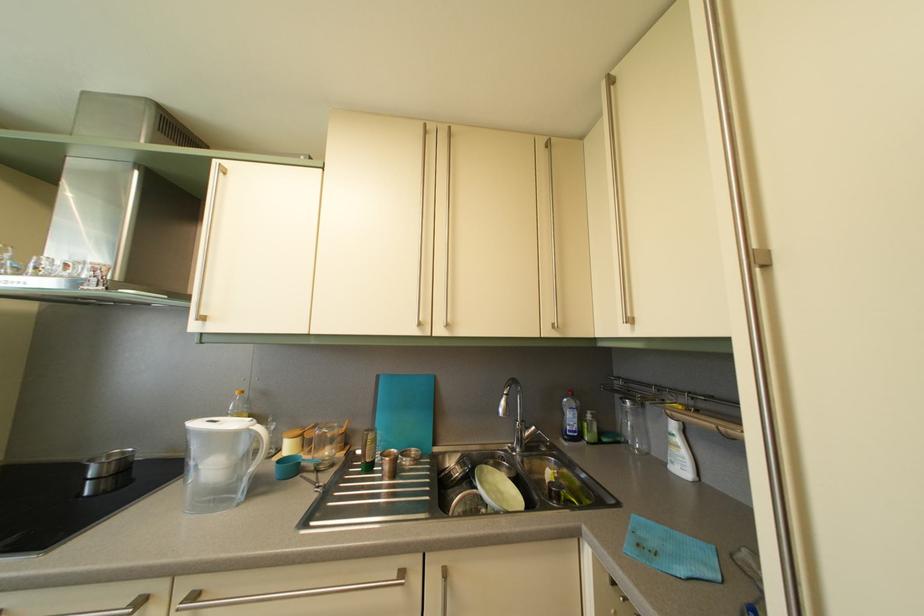
In order to click on faucet handle in this screenshot , I will do `click(528, 432)`.